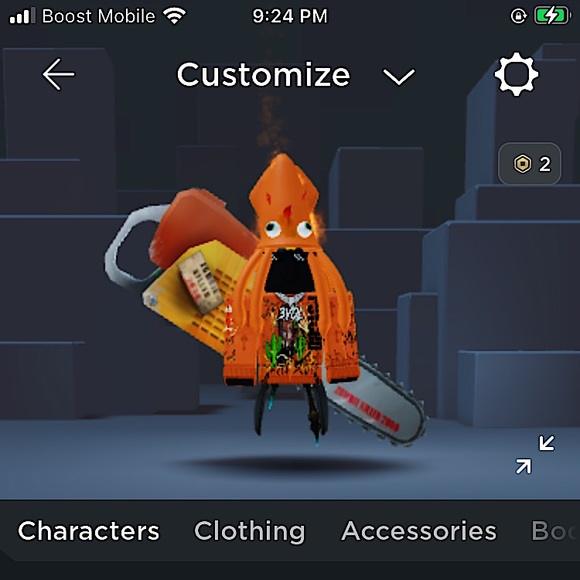
The height and width of the screenshot is (580, 580). I want to click on wall, so click(32, 299).